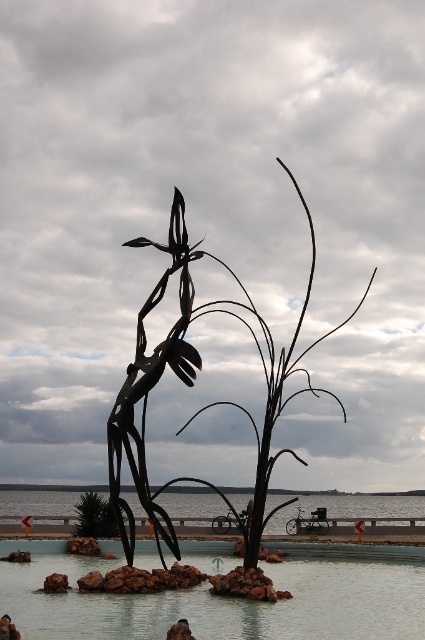
You are a landscape architect designing a garden. You need to place a new statue that is 2 meters wide. The green leafy tree at center and the brown rock at lower left are already in the garden. Can the statue fit between them without overlapping?

The green leafy tree at center is bigger than the brown rock at lower left. Since the statue is 2 meters wide, we need to know the distance between them. However, the description does not provide the distance between the green leafy tree at center and the brown rock at lower left, so we cannot determine if the statue will fit.

You are standing next to the water feature and want to see the reflection of the black metal tree at center. Will you be able to see its reflection in the clear water at center?

The black metal tree at center is located above clear water at center, so yes, you can see its reflection in the clear water at center because the water is calm and reflective.